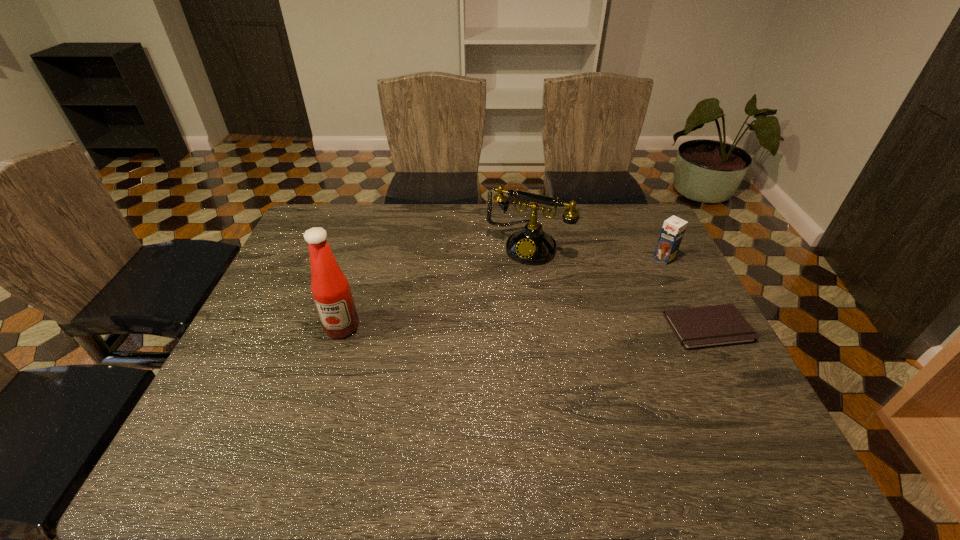
Find the location of a particular element. The height and width of the screenshot is (540, 960). free space located on the front label of the chocolate milk is located at coordinates (644, 272).

Where is `vacant space positioned 0.160m on the dial of the telephone`? The width and height of the screenshot is (960, 540). vacant space positioned 0.160m on the dial of the telephone is located at coordinates (492, 297).

The width and height of the screenshot is (960, 540). Identify the location of free space located 0.190m on the dial of the telephone. (489, 304).

Find the location of a particular element. This screenshot has height=540, width=960. vacant space located 0.150m on the dial of the telephone is located at coordinates (494, 295).

Locate an element on the screen. The height and width of the screenshot is (540, 960). object that is at the far edge is located at coordinates (531, 245).

In order to click on checkbook located at the right edge in this screenshot , I will do `click(720, 325)`.

What are the coordinates of `chocolate milk at the right edge` in the screenshot? It's located at (673, 229).

You are a GUI agent. You are given a task and a screenshot of the screen. Output one action in this format:
    pyautogui.click(x=<x>, y=<y>)
    Task: Click on the vacant area at the far edge of the desktop
    
    Given the screenshot: What is the action you would take?
    tap(598, 232)

The height and width of the screenshot is (540, 960). In the image, there is a desktop. Find the location of `vacant space at the near edge`. vacant space at the near edge is located at coordinates (639, 403).

Find the location of `vacant area at the right edge of the desktop`. vacant area at the right edge of the desktop is located at coordinates point(665,302).